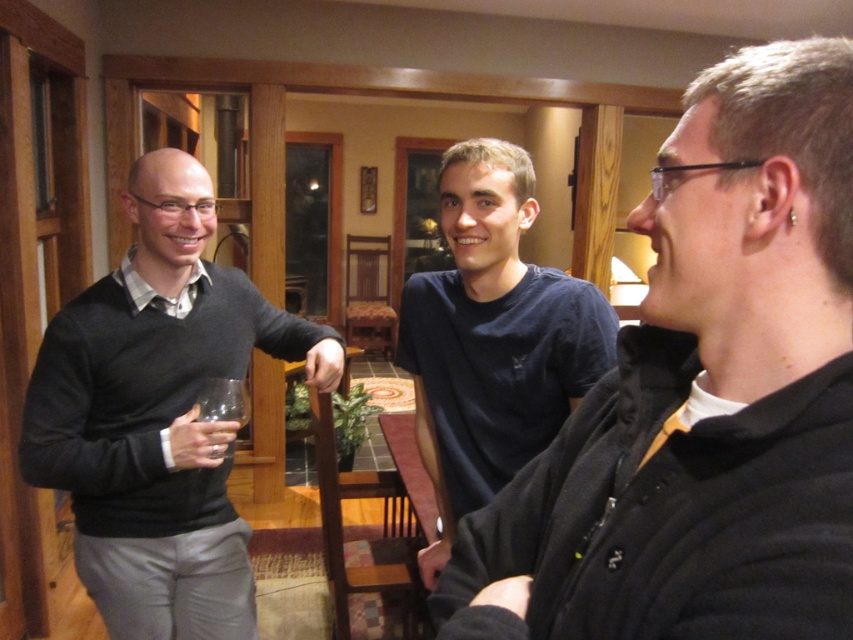
Which is more to the left, dark gray sweater at left or transparent glass at left?

Positioned to the left is dark gray sweater at left.

Which is in front, point (204, 282) or point (225, 406)?

Point (225, 406) is in front.

Where is `dark gray sweater at left`? dark gray sweater at left is located at coordinates (158, 413).

Does black matte shirt at upper right have a greater height compared to dark gray sweater at left?

Incorrect, black matte shirt at upper right's height is not larger of dark gray sweater at left's.

Does black matte shirt at upper right appear on the right side of dark gray sweater at left?

Correct, you'll find black matte shirt at upper right to the right of dark gray sweater at left.

Is point (815, 324) farther from viewer compared to point (312, 358)?

No, it is in front of (312, 358).

Find the location of `black matte shirt at upper right`. black matte shirt at upper right is located at coordinates (703, 396).

Does black matte shirt at upper right come behind transparent glass at left?

That is False.

Is black matte shirt at upper right to the left of transparent glass at left from the viewer's perspective?

No, black matte shirt at upper right is not to the left of transparent glass at left.

Does point (633, 538) lie behind point (241, 381)?

That is False.

Find the location of a particular element. The height and width of the screenshot is (640, 853). black matte shirt at upper right is located at coordinates (703, 396).